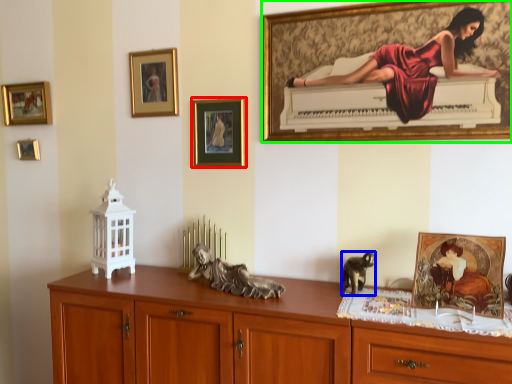
Question: Considering the real-world distances, which object is farthest from picture frame (highlighted by a red box)? animal (highlighted by a blue box) or picture frame (highlighted by a green box)?

Choices:
 (A) animal
 (B) picture frame

Answer: (A)